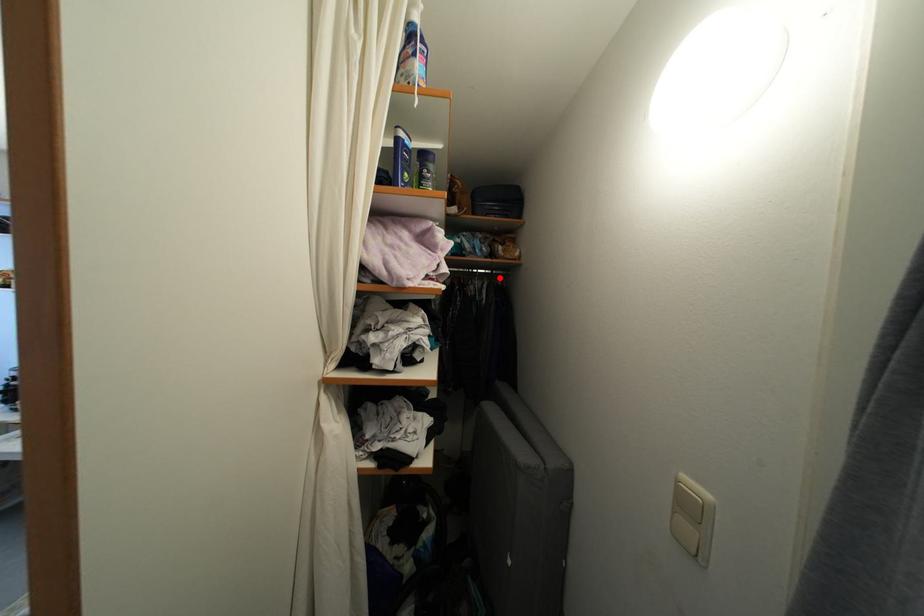
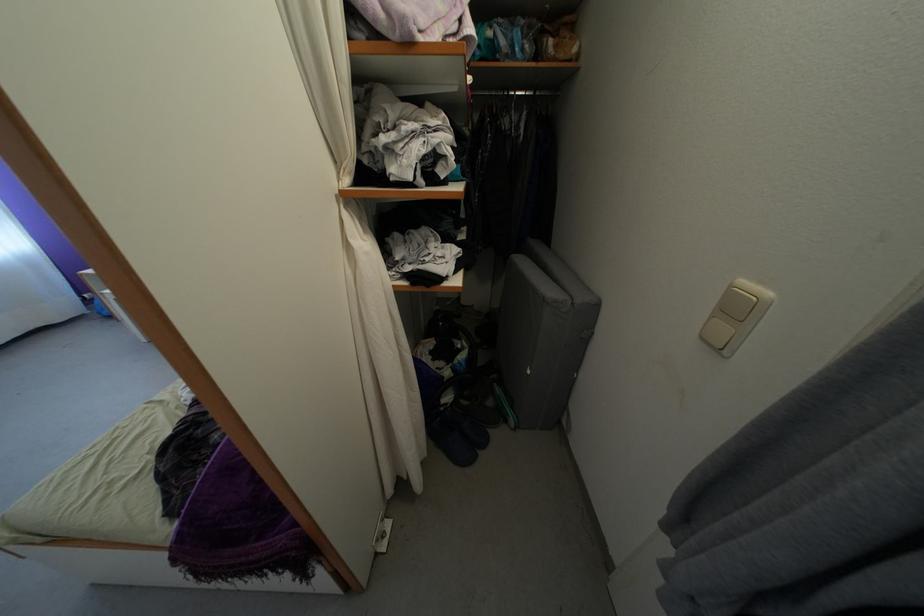
In the second image, find the point that corresponds to the highlighted location in the first image.

(543, 98)